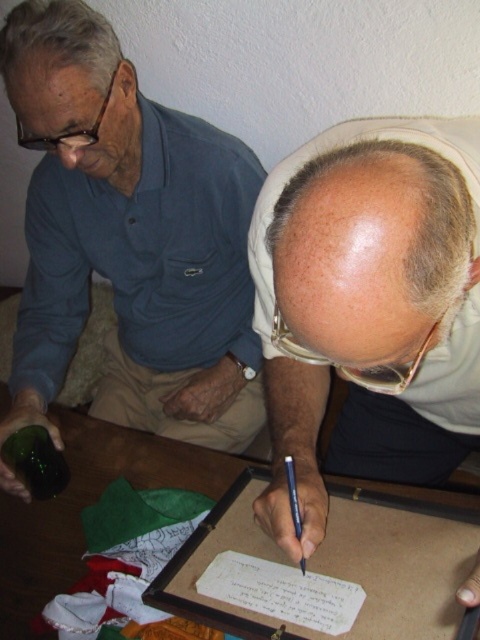
Question: Among these objects, which one is farthest from the camera?

Choices:
 (A) green matte bottle at lower left
 (B) smooth beige head at center

Answer: (A)

Question: Is matte blue shirt at left below smooth beige head at center?

Choices:
 (A) no
 (B) yes

Answer: (A)

Question: Which object is positioned closest to the metallic blue pen at lower center?

Choices:
 (A) wooden table at center
 (B) smooth beige head at center
 (C) green matte bottle at lower left

Answer: (B)

Question: Is matte blue shirt at left in front of green matte bottle at lower left?

Choices:
 (A) no
 (B) yes

Answer: (B)

Question: In this image, where is wooden table at center located relative to green matte bottle at lower left?

Choices:
 (A) left
 (B) right

Answer: (B)

Question: Among these objects, which one is farthest from the camera?

Choices:
 (A) smooth beige head at center
 (B) matte blue shirt at left

Answer: (B)